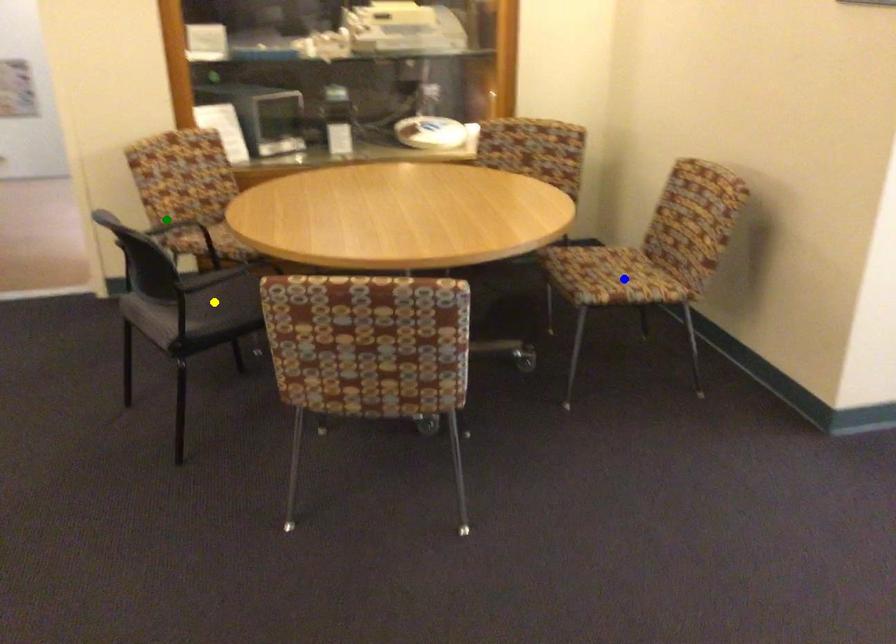
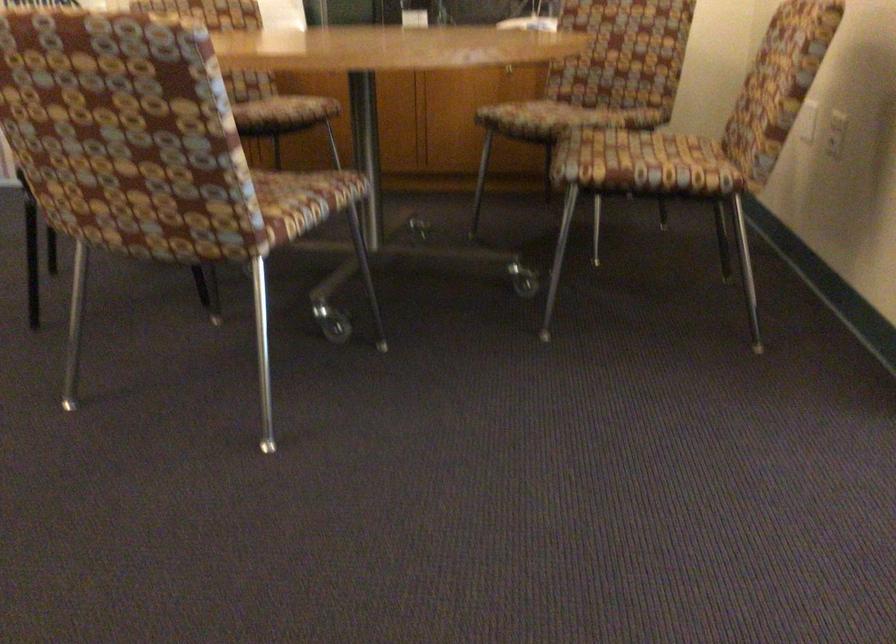
I am providing you with two images of the same scene from different viewpoints. Three points are marked in image1. Which point corresponds to a part or object that is occluded in image2?In image1, three points are marked. Which of them correspond to a part or object that is occluded in image2?Among the three points shown in image1, which one corresponds to a part or object that is no longer visible due to occlusion in image2?

green point, yellow point cannot be seen in image2.